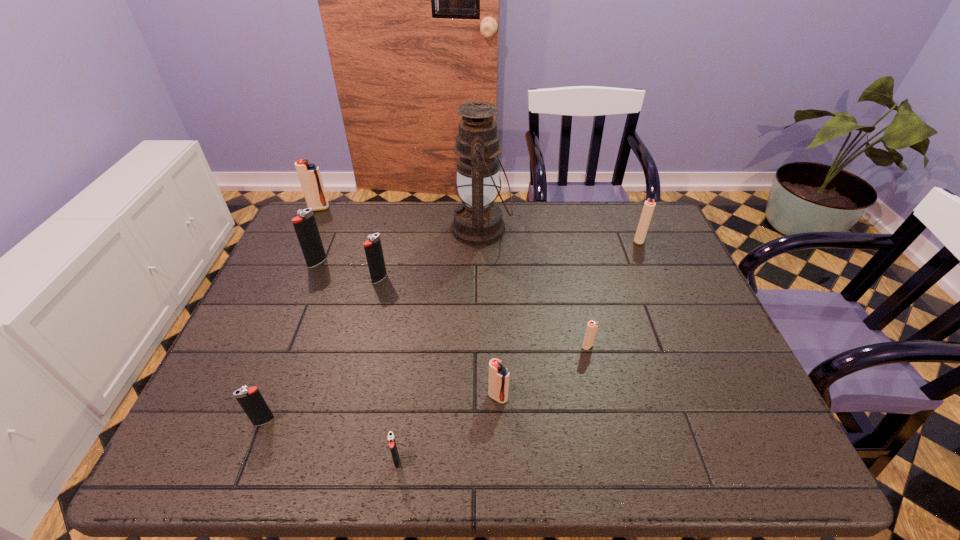
At what (x,y) coordinates should I click in order to perform the action: click on igniter that stands as the third closest to the second black igniter from right to left. Please return your answer as a coordinate pair (x, y). Image resolution: width=960 pixels, height=540 pixels. Looking at the image, I should click on (252, 402).

You are a GUI agent. You are given a task and a screenshot of the screen. Output one action in this format:
    pyautogui.click(x=<x>, y=<y>)
    Task: Click on the red igniter that is the third nearest to the fourth nearest igniter
    
    Given the screenshot: What is the action you would take?
    pyautogui.click(x=309, y=175)

Where is `red igniter that is the fourth nearest to the fifth farthest object`? The image size is (960, 540). red igniter that is the fourth nearest to the fifth farthest object is located at coordinates (649, 205).

Find the location of `black igniter that is the second closest to the third farthest black igniter`. black igniter that is the second closest to the third farthest black igniter is located at coordinates (373, 249).

I want to click on the third closest black igniter relative to the second red igniter from left to right, so click(252, 402).

Identify the location of vacant space that satisfies the following two spatial constraints: 1. on the front side of the farthest igniter; 2. on the right side of the eighth farthest object. The image size is (960, 540). (219, 421).